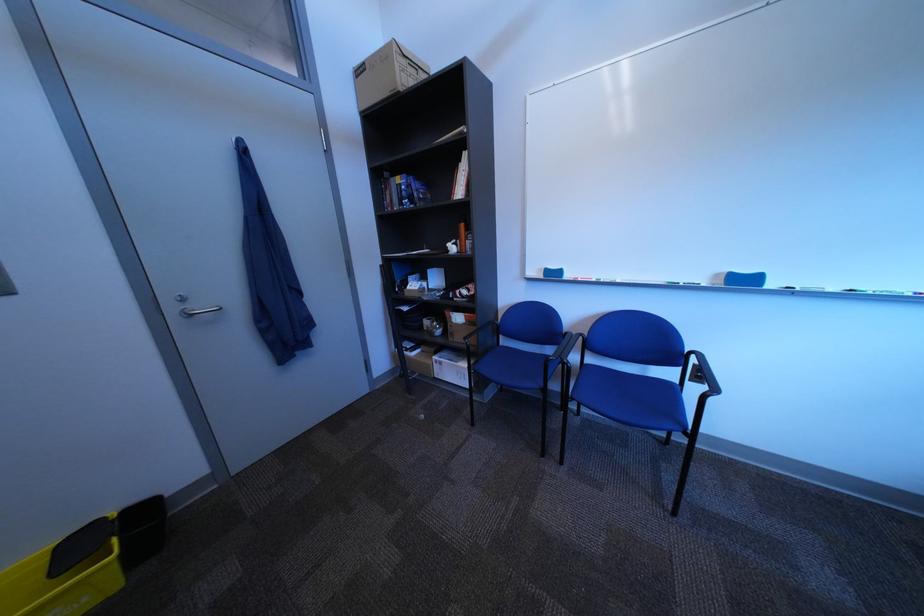
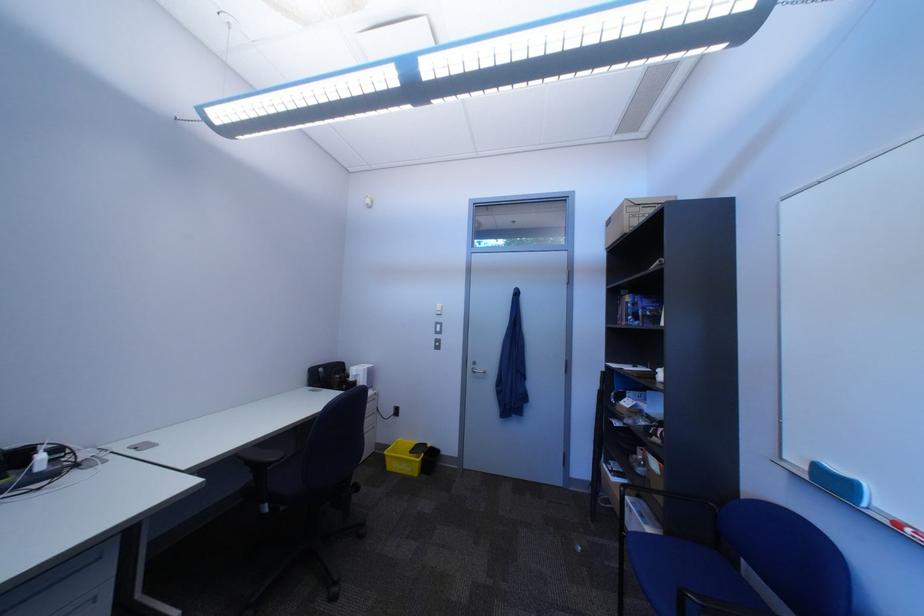
Where in the second image is the point corresponding to the point at 591,281 from the first image?

(915, 527)